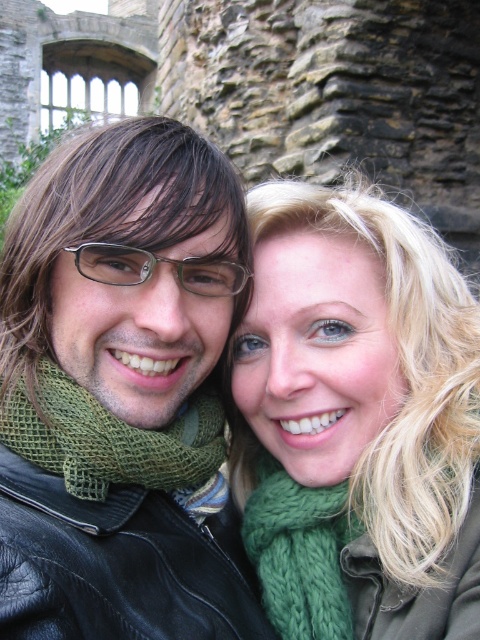
Question: Which point appears closest to the camera in this image?

Choices:
 (A) (115, 433)
 (B) (88, 260)

Answer: (A)

Question: Considering the real-world distances, which object is farthest from the green knitted scarf at center?

Choices:
 (A) green knitted scarf at left
 (B) green knitted scarf at lower right

Answer: (B)

Question: Which object is positioned farthest from the green knitted scarf at left?

Choices:
 (A) green knitted scarf at center
 (B) clear plastic glasses at center

Answer: (B)

Question: Is green knitted scarf at lower right wider than clear plastic glasses at center?

Choices:
 (A) yes
 (B) no

Answer: (B)

Question: Can you confirm if green knitted scarf at lower right is bigger than clear plastic glasses at center?

Choices:
 (A) no
 (B) yes

Answer: (A)

Question: Does green knitted scarf at center appear on the right side of green knitted scarf at lower right?

Choices:
 (A) no
 (B) yes

Answer: (A)